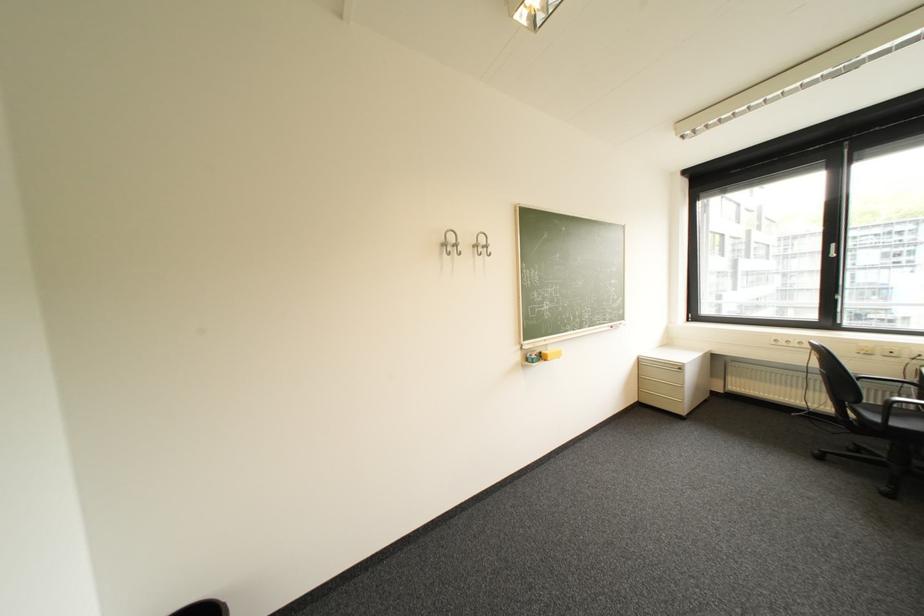
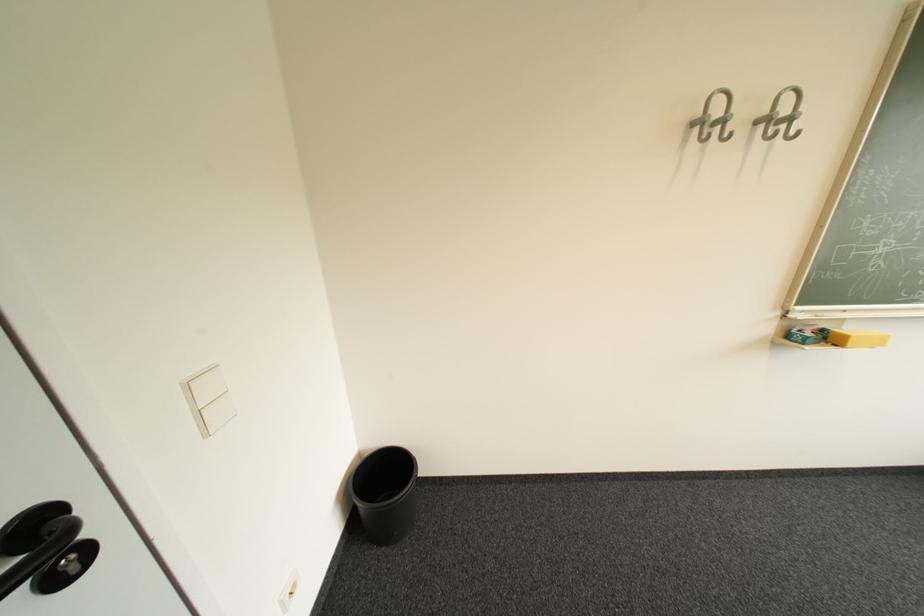
In the second image, find the point that corresponds to (x=555, y=361) in the first image.

(846, 346)